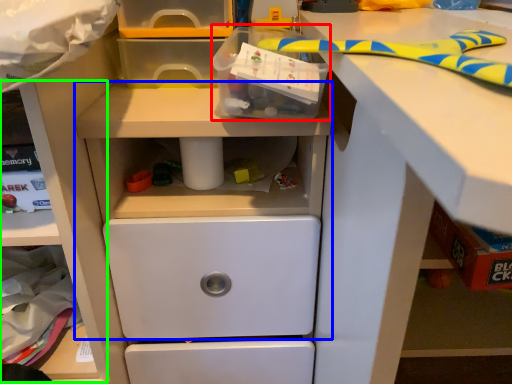
Question: Based on their relative distances, which object is nearer to box (highlighted by a red box)? Choose from workbench (highlighted by a blue box) and shelf (highlighted by a green box).

Choices:
 (A) workbench
 (B) shelf

Answer: (A)